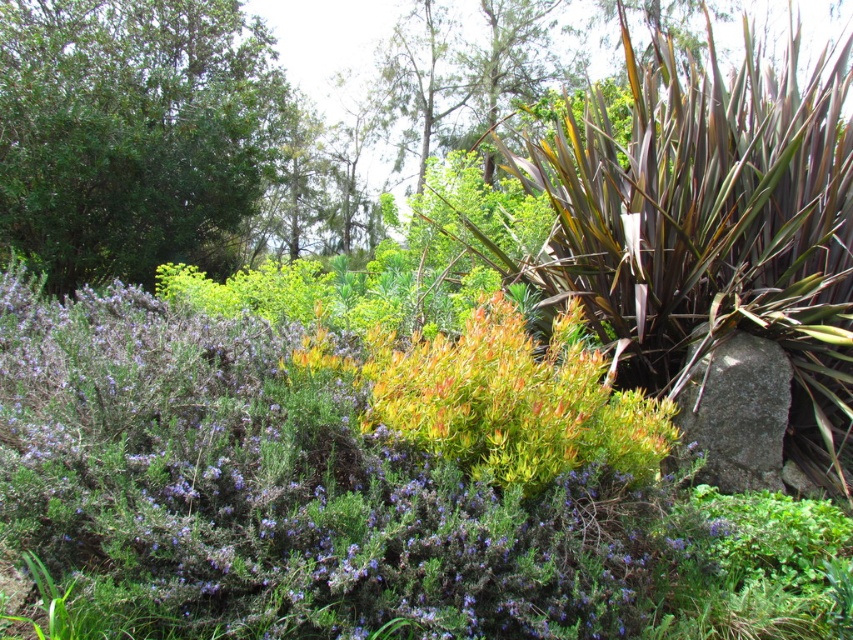
You are standing in the garden and want to locate the purple leafy bush at center. According to the coordinates provided, which direction should you move from your current position at the point marked as point (x=285, y=496)?

The point (x=285, y=496) is already at the purple leafy bush at center, so you are already there.

You are a gardener planning to plant a new flower bed. You have two options for placement based on the image. The purple leafy bush at center and the gray rough stone at lower right. Which object requires more space in the garden?

The purple leafy bush at center requires more space in the garden because it is larger in size than the gray rough stone at lower right.